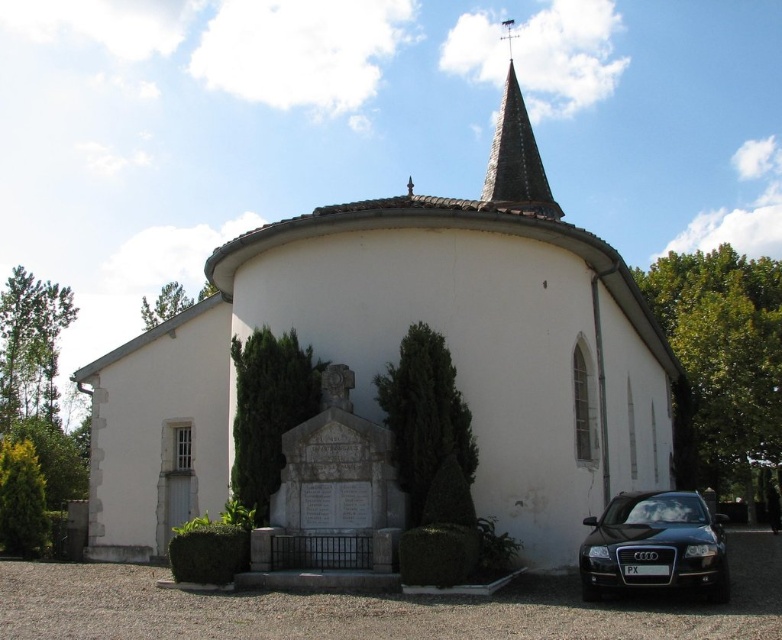
Measure the distance between green textured hedge at center and camera.

A distance of 81.51 feet exists between green textured hedge at center and camera.

Does point (429, 440) lie in front of point (253, 364)?

Yes, it is.

Is point (468, 474) less distant than point (256, 348)?

Yes, it is in front of point (256, 348).

Locate an element on the screen. The width and height of the screenshot is (782, 640). green textured hedge at center is located at coordinates (424, 416).

Is green textured hedge at center below green leafy tree at upper left?

Correct, green textured hedge at center is located below green leafy tree at upper left.

Between point (397, 435) and point (178, 292), which one is positioned behind?

Point (178, 292)

This screenshot has width=782, height=640. Describe the element at coordinates (424, 416) in the screenshot. I see `green textured hedge at center` at that location.

The width and height of the screenshot is (782, 640). In order to click on green textured hedge at center in this screenshot , I will do `click(424, 416)`.

Which is in front, point (34, 330) or point (508, 33)?

Point (34, 330) is in front.

Find the location of `green leafy tree at left`. green leafy tree at left is located at coordinates (30, 344).

Is point (6, 340) farther from camera compared to point (510, 92)?

Yes, point (6, 340) is farther from viewer.

Find the location of a particular element. The width and height of the screenshot is (782, 640). green leafy tree at left is located at coordinates (30, 344).